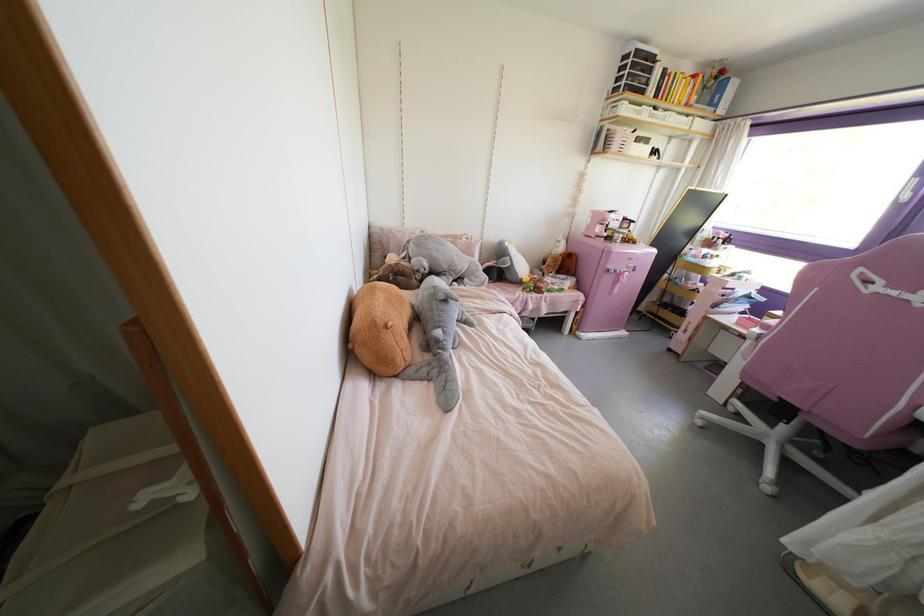
Image resolution: width=924 pixels, height=616 pixels. What are the coordinates of `white chair armrest` in the screenshot? It's located at (767, 323).